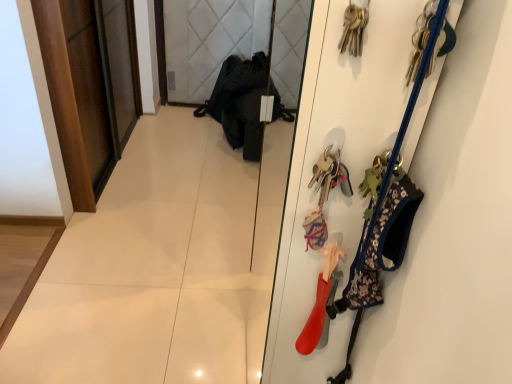
The image size is (512, 384). I want to click on vacant space to the left of clear glass mirror at center, so click(x=187, y=208).